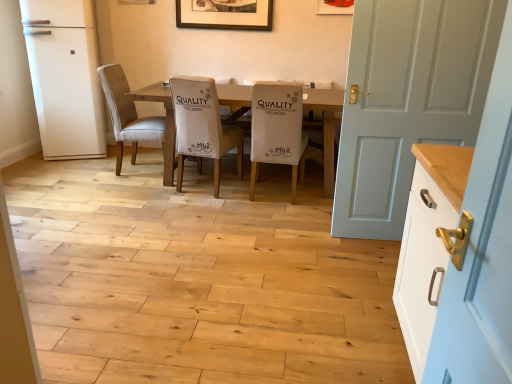
Identify the location of free space between wooden table at center and white painted wood cabinet at right. The width and height of the screenshot is (512, 384). (274, 244).